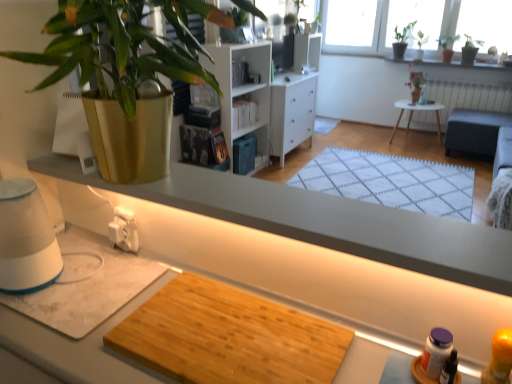
Locate an element on the screen. Image resolution: width=512 pixels, height=384 pixels. vacant point above wooden cutting board at center (from a real-world perspective) is located at coordinates tap(181, 311).